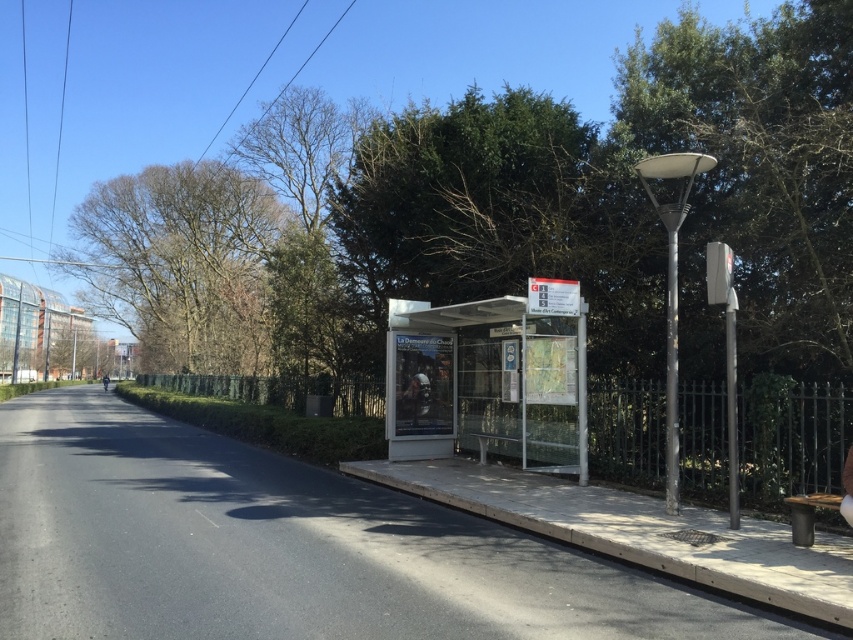
Question: Which object appears closest to the camera in this image?

Choices:
 (A) metallic silver bus stop at center
 (B) dark brown wooden bench at lower right
 (C) concrete pavement at center

Answer: (C)

Question: Based on their relative distances, which object is nearer to the concrete pavement at center?

Choices:
 (A) bare branches at upper left
 (B) dark brown wooden bench at lower right

Answer: (B)

Question: Does bare branches at upper left appear over dark brown wooden bench at lower right?

Choices:
 (A) yes
 (B) no

Answer: (A)

Question: From the image, what is the correct spatial relationship of concrete pavement at center in relation to dark brown wooden bench at lower right?

Choices:
 (A) below
 (B) above

Answer: (A)

Question: Can you confirm if concrete pavement at center is positioned to the left of bare branches at upper left?

Choices:
 (A) no
 (B) yes

Answer: (A)

Question: Which object is farther from the camera taking this photo?

Choices:
 (A) concrete pavement at center
 (B) bare branches at upper left

Answer: (B)